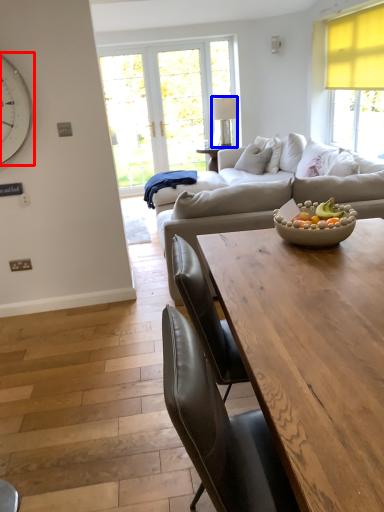
Question: Which object appears farthest to the camera in this image, clock (highlighted by a red box) or lamp (highlighted by a blue box)?

Choices:
 (A) clock
 (B) lamp

Answer: (B)